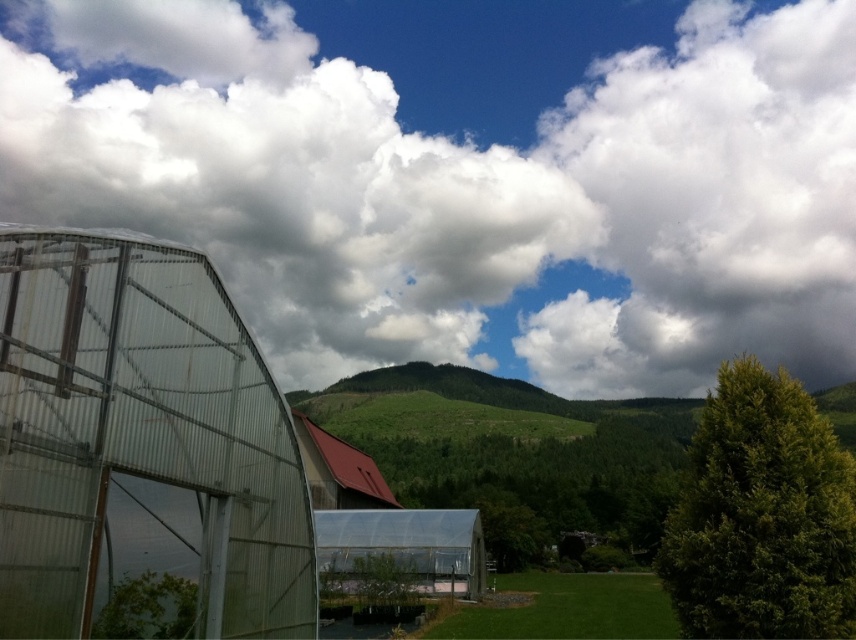
Question: Which object is closer to the camera taking this photo?

Choices:
 (A) white fluffy cloud at upper center
 (B) green textured tree at right
 (C) transparent plastic greenhouse at left

Answer: (C)

Question: Is white fluffy cloud at upper center further to the viewer compared to green textured tree at right?

Choices:
 (A) yes
 (B) no

Answer: (A)

Question: Is white fluffy cloud at upper center bigger than green textured tree at right?

Choices:
 (A) no
 (B) yes

Answer: (B)

Question: Which object appears closest to the camera in this image?

Choices:
 (A) green textured tree at right
 (B) white fluffy cloud at upper center

Answer: (A)

Question: Estimate the real-world distances between objects in this image. Which object is closer to the transparent plastic greenhouse at left?

Choices:
 (A) white fluffy cloud at upper center
 (B) green textured tree at right

Answer: (B)

Question: Is transparent plastic greenhouse at left positioned in front of green textured tree at right?

Choices:
 (A) no
 (B) yes

Answer: (B)